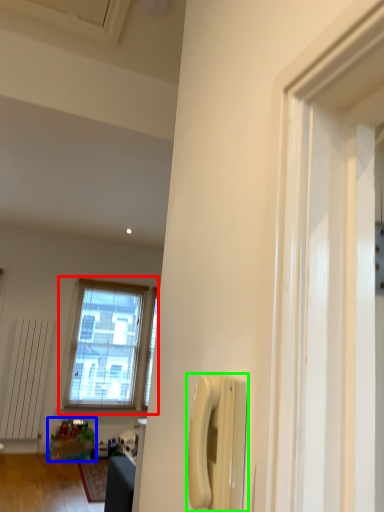
Question: Estimate the real-world distances between objects in this image. Which object is closer to window (highlighted by a red box), toy (highlighted by a blue box) or corded phone (highlighted by a green box)?

Choices:
 (A) toy
 (B) corded phone

Answer: (A)